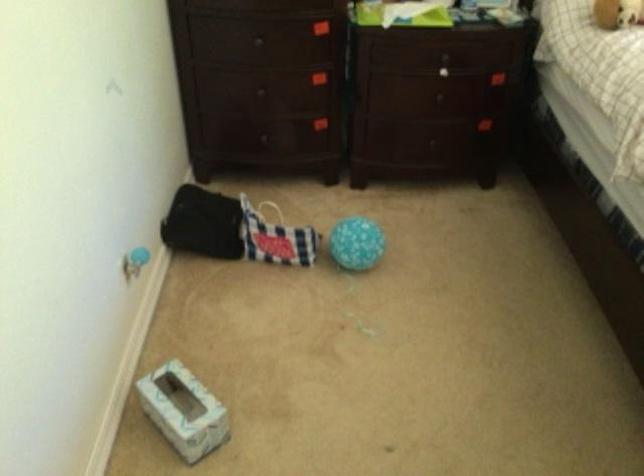
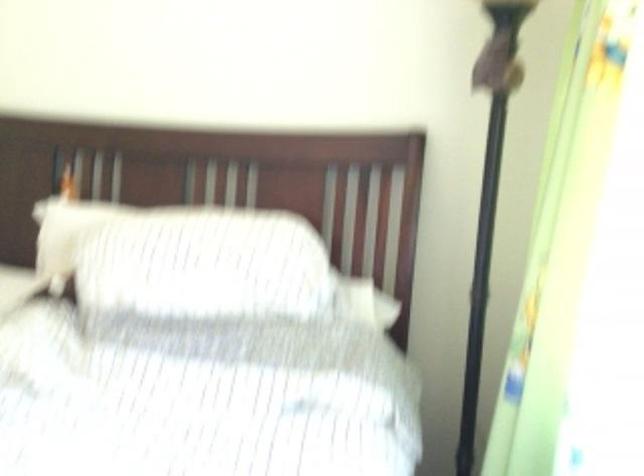
Question: The images are taken continuously from a first-person perspective. In which direction are you moving?

Choices:
 (A) Left
 (B) Right
 (C) Forward
 (D) Backward

Answer: (B)